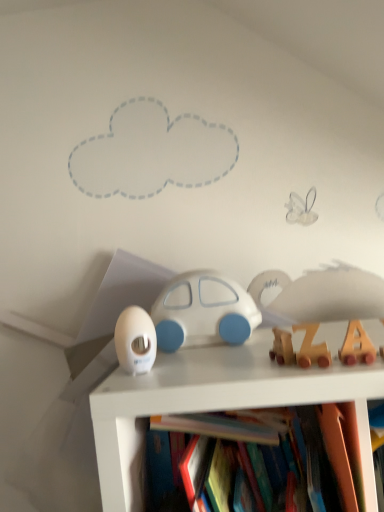
Question: Is white matte car at center, arranged as the 2th toy when viewed from the left, at the right side of wooden train at right, arranged as the third toy when viewed from the left?

Choices:
 (A) yes
 (B) no

Answer: (B)

Question: Can you confirm if white matte car at center, acting as the 3th toy starting from the right, is taller than wooden train at right, the 3th toy from the back?

Choices:
 (A) yes
 (B) no

Answer: (A)

Question: From the image's perspective, is white matte car at center, the 4th toy positioned from the front, above wooden train at right, acting as the 2th toy starting from the right?

Choices:
 (A) yes
 (B) no

Answer: (A)

Question: From a real-world perspective, is white matte car at center, acting as the 3th toy starting from the right, located beneath wooden train at right, acting as the 2th toy starting from the right?

Choices:
 (A) no
 (B) yes

Answer: (A)

Question: Considering the relative positions of white matte car at center, the first toy viewed from the back, and wooden train at right, acting as the 2th toy starting from the right, in the image provided, is white matte car at center, the first toy viewed from the back, behind wooden train at right, acting as the 2th toy starting from the right,?

Choices:
 (A) yes
 (B) no

Answer: (A)

Question: Is point (342, 360) closer or farther from the camera than point (304, 357)?

Choices:
 (A) closer
 (B) farther

Answer: (A)

Question: Is wooden letter blocks at center-right, placed as the 1th toy when sorted from front to back, inside or outside of wooden train at right, the 3th toy from the back?

Choices:
 (A) outside
 (B) inside

Answer: (A)

Question: Based on their sizes in the image, would you say wooden letter blocks at center-right, which ranks as the fourth toy in back-to-front order, is bigger or smaller than wooden train at right, arranged as the third toy when viewed from the left?

Choices:
 (A) big
 (B) small

Answer: (B)

Question: From the image's perspective, is wooden letter blocks at center-right, which ranks as the fourth toy in back-to-front order, above or below wooden train at right, arranged as the third toy when viewed from the left?

Choices:
 (A) above
 (B) below

Answer: (A)

Question: Considering the relative positions of wooden train at right, arranged as the third toy when viewed from the left, and white glossy egg at center, arranged as the 2th toy when viewed from the back, in the image provided, is wooden train at right, arranged as the third toy when viewed from the left, to the left or to the right of white glossy egg at center, arranged as the 2th toy when viewed from the back,?

Choices:
 (A) right
 (B) left

Answer: (A)

Question: From the image's perspective, is wooden train at right, the 3th toy from the back, positioned above or below white glossy egg at center, the 1th toy positioned from the left?

Choices:
 (A) below
 (B) above

Answer: (B)

Question: Is wooden train at right, acting as the 2th toy starting from the right, situated inside white glossy egg at center, placed as the third toy when sorted from front to back, or outside?

Choices:
 (A) outside
 (B) inside

Answer: (A)

Question: Based on their sizes in the image, would you say wooden train at right, the 2th toy positioned from the front, is bigger or smaller than white glossy egg at center, arranged as the 2th toy when viewed from the back?

Choices:
 (A) big
 (B) small

Answer: (B)

Question: Is point (350, 348) closer or farther from the camera than point (137, 330)?

Choices:
 (A) closer
 (B) farther

Answer: (A)

Question: In terms of width, does wooden letter blocks at center-right, which ranks as the fourth toy in back-to-front order, look wider or thinner when compared to white glossy egg at center, the 1th toy positioned from the left?

Choices:
 (A) thin
 (B) wide

Answer: (A)